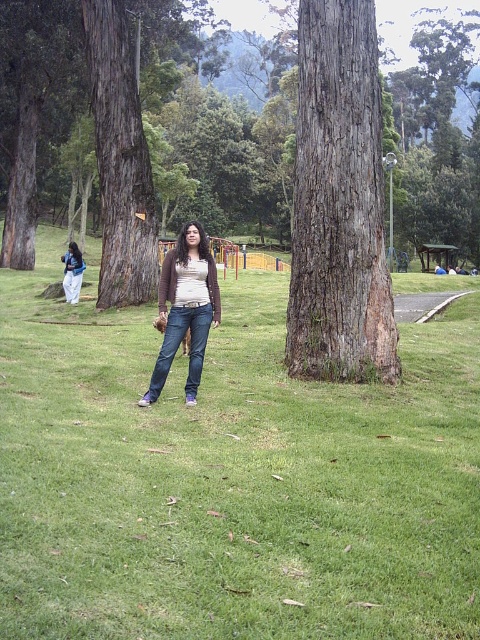
You are a photographer trying to capture a photo of the green grassy at center and denim jeans at center in the park scene. Based on their sizes, which object would occupy more space in your photo?

The green grassy at center is larger in size than the denim jeans at center, so it would occupy more space in the photo.

You are a photographer trying to capture the smooth brown bark at center and the matte white pants at lower left in the same frame. Based on their positions, which object should you focus on first to ensure both are in focus?

The smooth brown bark at center has a lesser height compared to matte white pants at lower left, so you should focus on the matte white pants at lower left first since it is taller and might be further away, ensuring both are in focus.